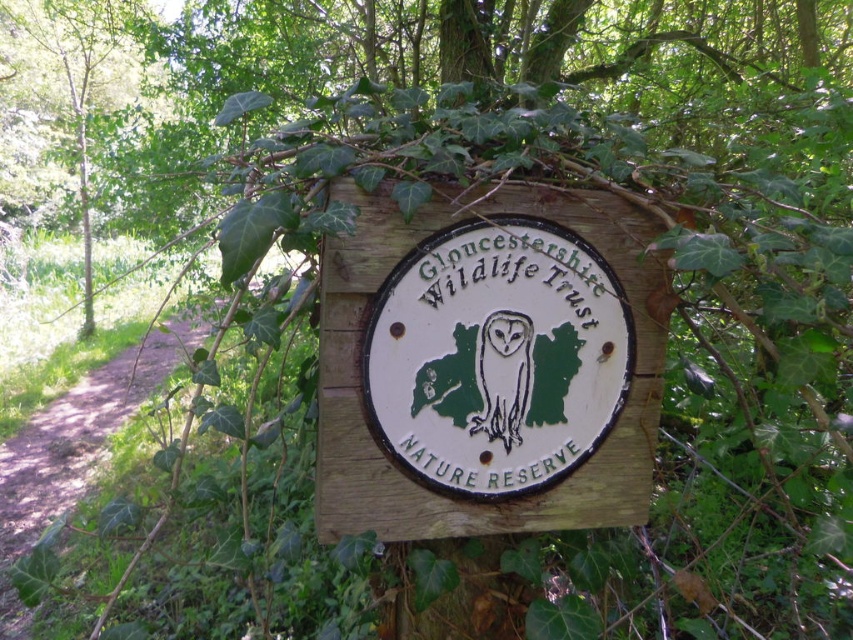
Is wooden sign at center further to the viewer compared to dirt path at left?

No, wooden sign at center is closer to the viewer.

Which of these two, wooden sign at center or dirt path at left, stands shorter?

wooden sign at center is shorter.

Does point (358, 419) come closer to viewer compared to point (67, 406)?

Yes, it is in front of point (67, 406).

Where is `wooden sign at center`? Image resolution: width=853 pixels, height=640 pixels. wooden sign at center is located at coordinates (360, 394).

Is point (155, 381) positioned before point (508, 368)?

No, (155, 381) is further to viewer.

Is point (120, 410) less distant than point (509, 333)?

No, it is behind (509, 333).

This screenshot has height=640, width=853. Find the location of `dirt path at left`. dirt path at left is located at coordinates point(74,448).

Consider the image. Can you confirm if wooden sign at center is wider than white paper owl at center?

Correct, the width of wooden sign at center exceeds that of white paper owl at center.

Is wooden sign at center above white paper owl at center?

Yes.

Between point (595, 504) and point (480, 429), which one is positioned in front?

Point (480, 429) is more forward.

Where is `wooden sign at center`? wooden sign at center is located at coordinates (360, 394).